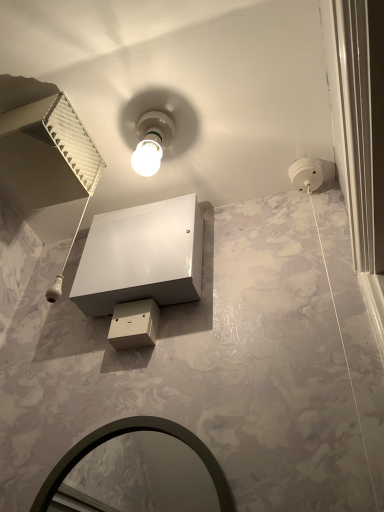
Question: Could you tell me if white glossy vanity at center is turned towards white glossy bulb at upper center?

Choices:
 (A) no
 (B) yes

Answer: (B)

Question: From a real-world perspective, is white glossy vanity at center on top of white glossy bulb at upper center?

Choices:
 (A) no
 (B) yes

Answer: (A)

Question: Does white glossy vanity at center come behind white glossy bulb at upper center?

Choices:
 (A) no
 (B) yes

Answer: (A)

Question: Can you confirm if white glossy vanity at center is bigger than white glossy bulb at upper center?

Choices:
 (A) no
 (B) yes

Answer: (B)

Question: Is white glossy vanity at center taller than white glossy bulb at upper center?

Choices:
 (A) yes
 (B) no

Answer: (A)

Question: Are white glossy vanity at center and white glossy bulb at upper center beside each other?

Choices:
 (A) no
 (B) yes

Answer: (A)

Question: Is the depth of matte black mirror at lower center less than that of white glossy bulb at upper center?

Choices:
 (A) yes
 (B) no

Answer: (A)

Question: From the image's perspective, is matte black mirror at lower center located beneath white glossy bulb at upper center?

Choices:
 (A) no
 (B) yes

Answer: (B)

Question: Is matte black mirror at lower center touching white glossy bulb at upper center?

Choices:
 (A) no
 (B) yes

Answer: (A)

Question: Can you confirm if matte black mirror at lower center is taller than white glossy bulb at upper center?

Choices:
 (A) no
 (B) yes

Answer: (B)

Question: Is matte black mirror at lower center shorter than white glossy bulb at upper center?

Choices:
 (A) yes
 (B) no

Answer: (B)

Question: Does matte black mirror at lower center have a lesser width compared to white glossy bulb at upper center?

Choices:
 (A) no
 (B) yes

Answer: (B)

Question: Is white glossy bulb at upper center oriented towards white glossy vanity at center?

Choices:
 (A) no
 (B) yes

Answer: (A)